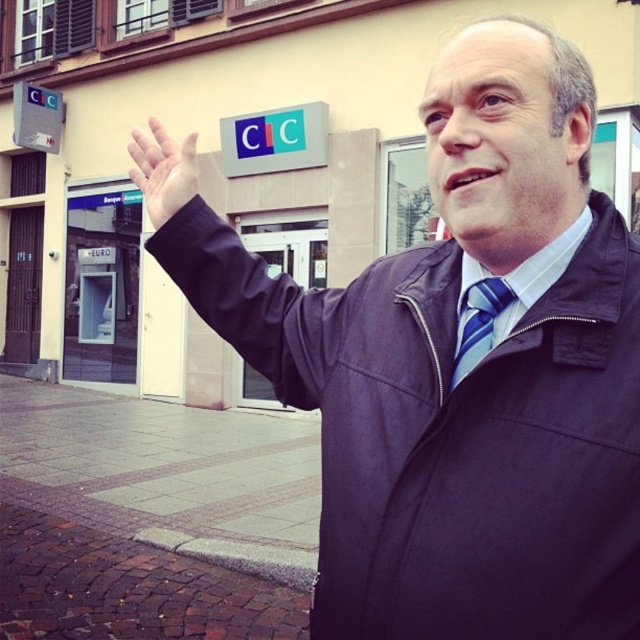
You are a photographer trying to capture a clear shot of both the black leather arm at upper center and the blue striped tie at center. Can you fit both in your camera frame if the maximum distance your camera can accommodate between the closest and farthest objects is 18 inches?

The black leather arm at upper center and blue striped tie at center are 18.51 inches apart from each other. Since the camera can only accommodate up to 18 inches, the distance between them exceeds the limit by 0.51 inches, so both cannot be captured clearly in the same frame.

You are a security guard observing a scene where a man is standing in front of a building with a CIC logo. You notice two objects in the image labeled as black leather arm at upper center and matte black hand at upper left. Which object is located to the right of the other?

The black leather arm at upper center is positioned on the right side of the matte black hand at upper left.

You are standing in front of the building with the CIC logo. You see two points marked on the facade. Which point is closer to you, point (132,131) or point (474,348)?

Point (132,131) is closer to you because it is further to the viewer than point (474,348).